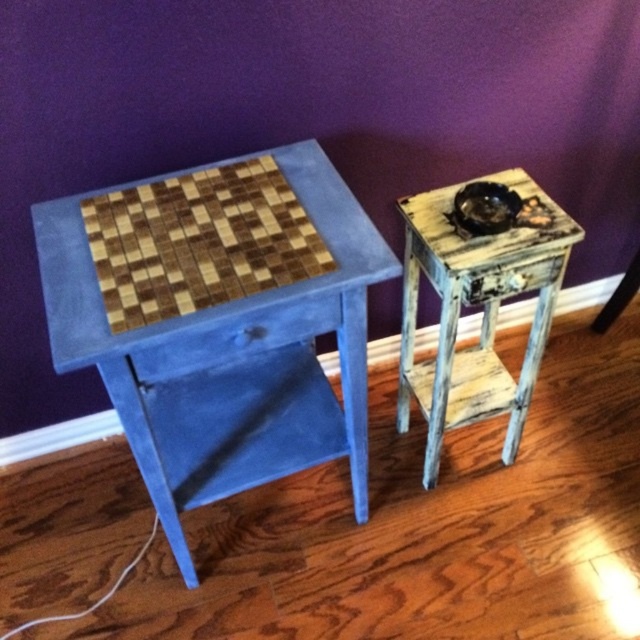
Who is positioned more to the right, blue painted wood table at left or distressed wood side table at right?

distressed wood side table at right

Does blue painted wood table at left have a lesser width compared to distressed wood side table at right?

In fact, blue painted wood table at left might be wider than distressed wood side table at right.

Which is in front, point (172, 397) or point (490, 250)?

Point (490, 250) is more forward.

Find the location of a particular element. blue painted wood table at left is located at coordinates point(228,358).